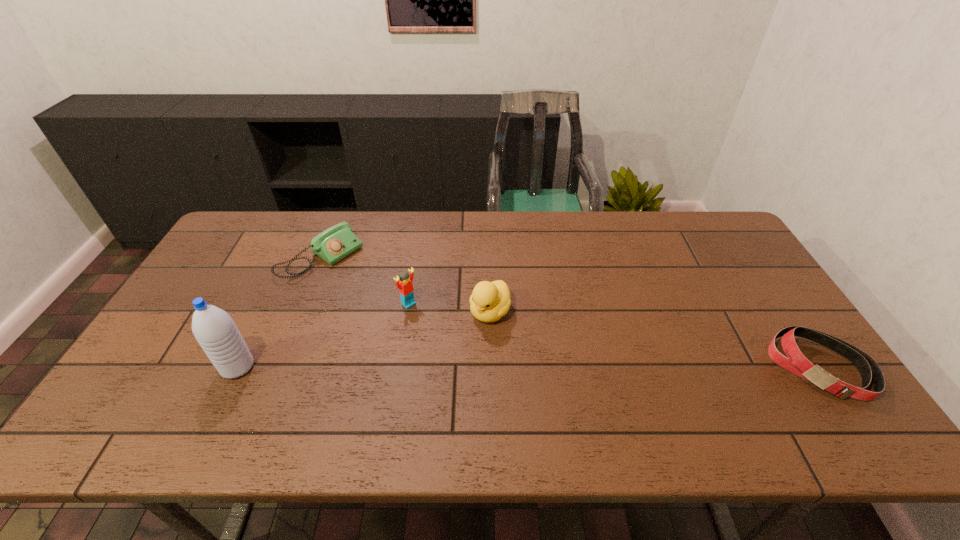
Locate an element on the screen. Image resolution: width=960 pixels, height=540 pixels. vacant space on the desktop that is between the tallest object and the dog collar and is positioned on the face of the third object from left to right is located at coordinates (483, 367).

The height and width of the screenshot is (540, 960). I want to click on free space on the desktop that is between the water bottle and the rightmost object and is positioned on the front-facing side of the second object from right to left, so click(x=451, y=367).

Where is `free space on the desktop that is between the tallest object and the dog collar and is positioned on the dial of the telephone`? The width and height of the screenshot is (960, 540). free space on the desktop that is between the tallest object and the dog collar and is positioned on the dial of the telephone is located at coordinates (475, 367).